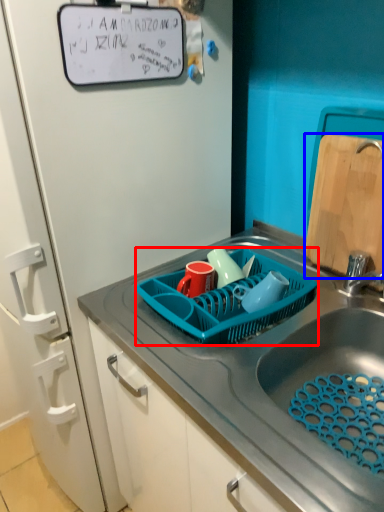
Question: Among these objects, which one is nearest to the camera, basket (highlighted by a red box) or cutting board (highlighted by a blue box)?

Choices:
 (A) basket
 (B) cutting board

Answer: (A)